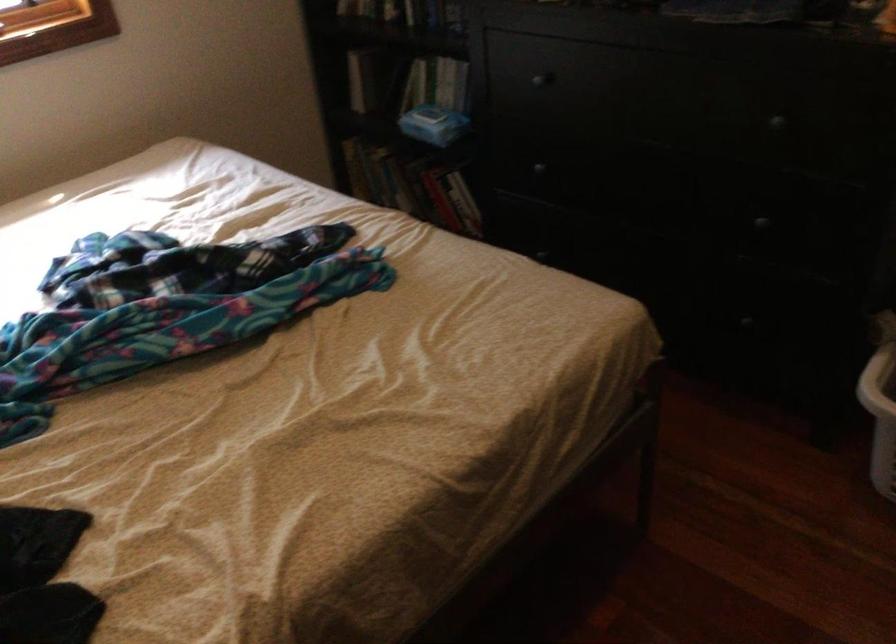
Find where to lift the blue tissue box. Please return your answer as a coordinate pair (x, y).

(433, 124)